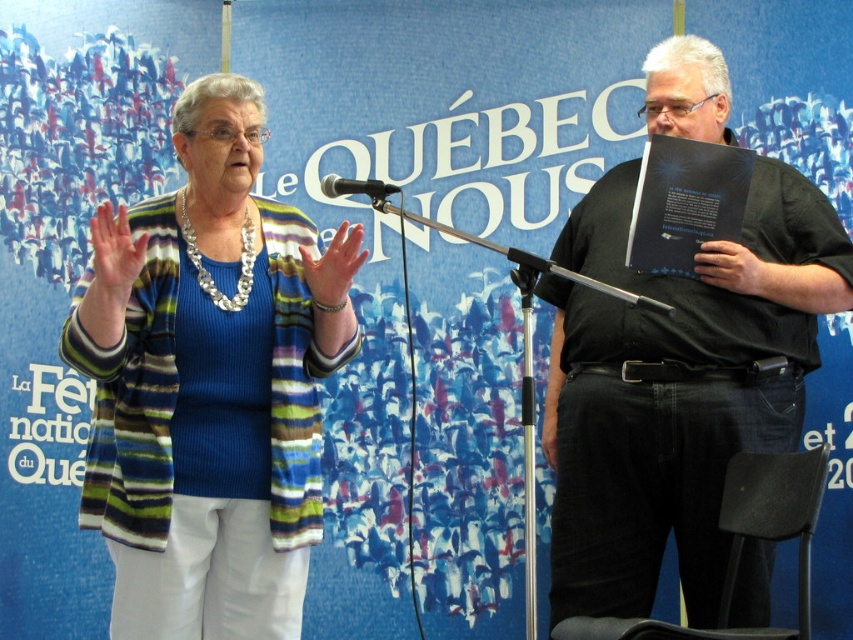
You are an attendee at the event and want to ask a question using the black plastic microphone at center. However, you also notice the black matte book at center. Which object is closer to you, the attendee, so you can reach it first?

The black matte book at center is closer to you than the black plastic microphone at center, so you can reach it first.

You are attending a cultural event in Quebec and notice two items at the center of the stage. There is a black matte shirt at center and a black plastic microphone at center. Which item is positioned to the right of the other?

The black matte shirt at center is to the right of the black plastic microphone at center.

You are at a Quebec provincial celebration and see the striped knit cardigan at center. Where exactly is it located in the image?

The striped knit cardigan at center is located at the coordinates point (209, 394).